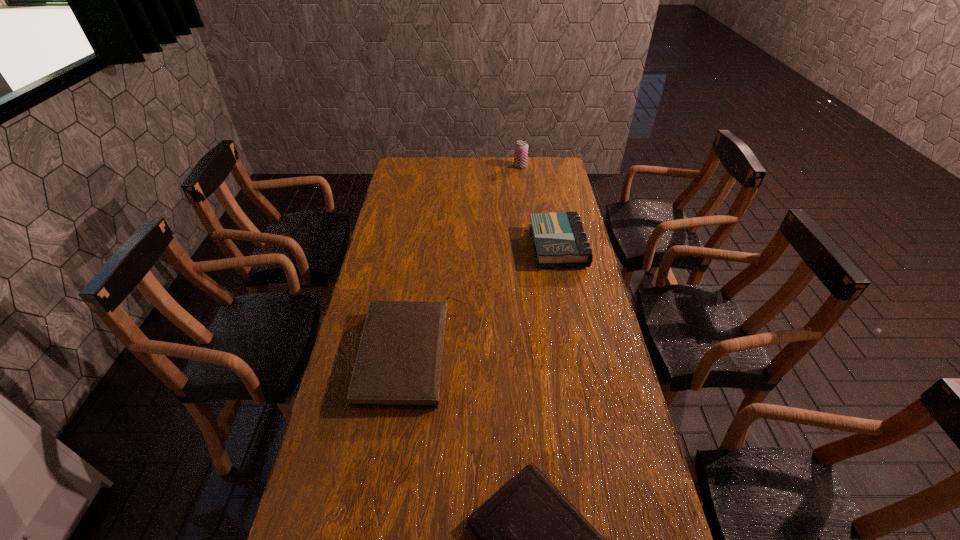
Select which object is the second closest to the second shortest object. Please provide its 2D coordinates. Your answer should be formatted as a tuple, i.e. [(x, y)], where the tuple contains the x and y coordinates of a point satisfying the conditions above.

[(558, 238)]

Where is `paperback book that stands as the second closest to the beer can`? The height and width of the screenshot is (540, 960). paperback book that stands as the second closest to the beer can is located at coordinates (399, 361).

Locate which paperback book ranks in proximity to the second farthest object. Please provide its 2D coordinates. Your answer should be formatted as a tuple, i.e. [(x, y)], where the tuple contains the x and y coordinates of a point satisfying the conditions above.

[(399, 361)]

Locate an element on the screen. The width and height of the screenshot is (960, 540). vacant area in the image that satisfies the following two spatial constraints: 1. on the front side of the tallest paperback book; 2. on the spine side of the second shortest object is located at coordinates (580, 354).

The image size is (960, 540). I want to click on vacant space that satisfies the following two spatial constraints: 1. on the front side of the tallest object; 2. on the spine side of the second farthest paperback book, so click(545, 354).

Find the location of `free space that satisfies the following two spatial constraints: 1. on the front side of the farthest object; 2. on the left side of the tallest paperback book`. free space that satisfies the following two spatial constraints: 1. on the front side of the farthest object; 2. on the left side of the tallest paperback book is located at coordinates (531, 247).

The height and width of the screenshot is (540, 960). Find the location of `vacant space that satisfies the following two spatial constraints: 1. on the front side of the farthest object; 2. on the spine side of the second farthest paperback book`. vacant space that satisfies the following two spatial constraints: 1. on the front side of the farthest object; 2. on the spine side of the second farthest paperback book is located at coordinates (545, 354).